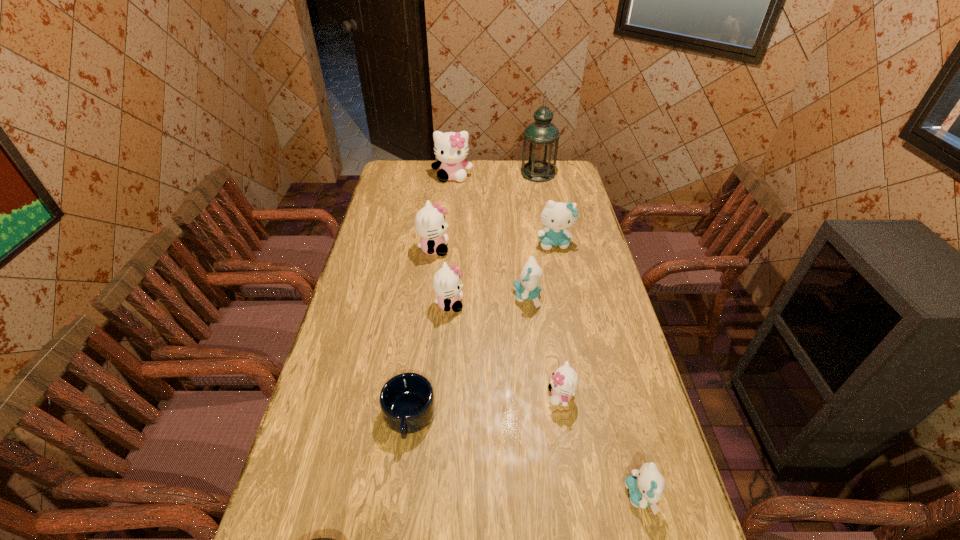
You are a GUI agent. You are given a task and a screenshot of the screen. Output one action in this format:
    pyautogui.click(x=<x>, y=<y>)
    Task: Click on the empty location between the biggest white kitten and the farthest blue kitten
    Image resolution: width=960 pixels, height=540 pixels.
    Given the screenshot: What is the action you would take?
    pyautogui.click(x=503, y=210)

The width and height of the screenshot is (960, 540). I want to click on free space between the rightmost white kitten and the second farthest blue kitten, so [x=544, y=346].

You are a GUI agent. You are given a task and a screenshot of the screen. Output one action in this format:
    pyautogui.click(x=<x>, y=<y>)
    Task: Click on the empty space that is in between the farthest white kitten and the third biggest white kitten
    
    Given the screenshot: What is the action you would take?
    pyautogui.click(x=451, y=240)

The image size is (960, 540). I want to click on blank region between the farthest white kitten and the third biggest white kitten, so click(451, 240).

Where is `free area in between the nearest kitten and the second farthest white kitten`? free area in between the nearest kitten and the second farthest white kitten is located at coordinates (538, 372).

Where is `object that ranks as the fifth closest to the green oil lamp`? Image resolution: width=960 pixels, height=540 pixels. object that ranks as the fifth closest to the green oil lamp is located at coordinates tap(447, 284).

You are a GUI agent. You are given a task and a screenshot of the screen. Output one action in this format:
    pyautogui.click(x=<x>, y=<y>)
    Task: Click on the object that is the third closest one to the ninth shortest object
    The image size is (960, 540).
    Given the screenshot: What is the action you would take?
    pyautogui.click(x=557, y=216)

Select which kitten appears as the seventh closest to the mug. Please provide its 2D coordinates. Your answer should be formatted as a tuple, i.e. [(x, y)], where the tuple contains the x and y coordinates of a point satisfying the conditions above.

[(451, 148)]

Where is `the fourth closest kitten to the third smallest white kitten`? The image size is (960, 540). the fourth closest kitten to the third smallest white kitten is located at coordinates 451,148.

Find the location of a particular element. The width and height of the screenshot is (960, 540). white kitten that can be found as the fourth closest to the tallest object is located at coordinates (564, 381).